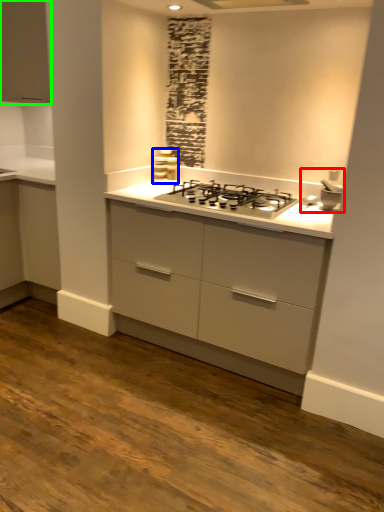
Question: Estimate the real-world distances between objects in this image. Which object is closer to sink (highlighted by a red box), appliance (highlighted by a blue box) or cabinetry (highlighted by a green box)?

Choices:
 (A) appliance
 (B) cabinetry

Answer: (A)